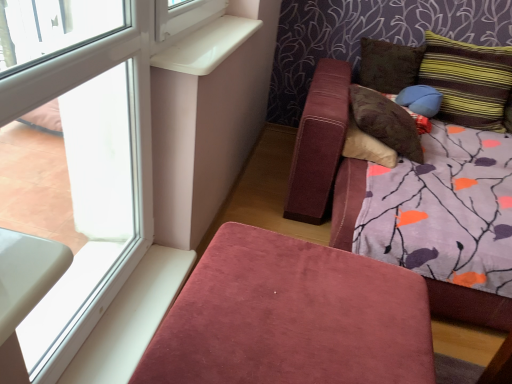
Question: In terms of height, does blue fabric pillow at upper right, arranged as the second pillow when viewed from the right, look taller or shorter compared to velvet pink ottoman at lower center?

Choices:
 (A) short
 (B) tall

Answer: (A)

Question: Based on their positions, is blue fabric pillow at upper right, arranged as the second pillow when viewed from the right, located to the left or right of velvet pink ottoman at lower center?

Choices:
 (A) left
 (B) right

Answer: (B)

Question: Estimate the real-world distances between objects in this image. Which object is farther from the brown suede pillow at upper right, which ranks as the third pillow in right-to-left order?

Choices:
 (A) transparent glass window at upper left
 (B) velvet pink ottoman at lower center
 (C) blue fabric pillow at upper right, arranged as the second pillow when viewed from the right
 (D) striped fabric pillow at upper right, which appears as the 4th pillow when viewed from the left
 (E) brown suede pillow at upper right, the 1th pillow positioned from the left

Answer: (B)

Question: Based on their relative distances, which object is farther from the brown suede pillow at upper right, which ranks as the third pillow in right-to-left order?

Choices:
 (A) brown suede pillow at upper right, the 1th pillow positioned from the left
 (B) transparent glass window at upper left
 (C) white plastic window sill at upper left
 (D) velvet pink ottoman at lower center
 (E) blue fabric pillow at upper right, which ranks as the third pillow in left-to-right order

Answer: (D)